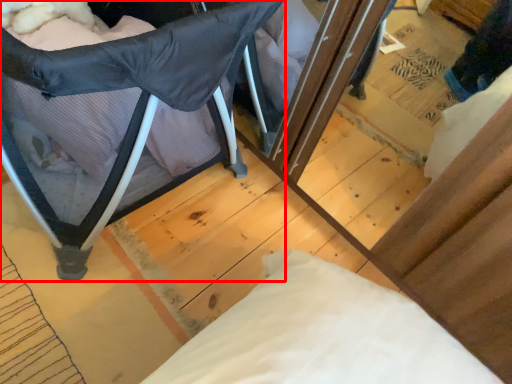
Question: From the image's perspective, what is the correct spatial positioning of furniture (annotated by the red box) in reference to pillow?

Choices:
 (A) below
 (B) above

Answer: (A)